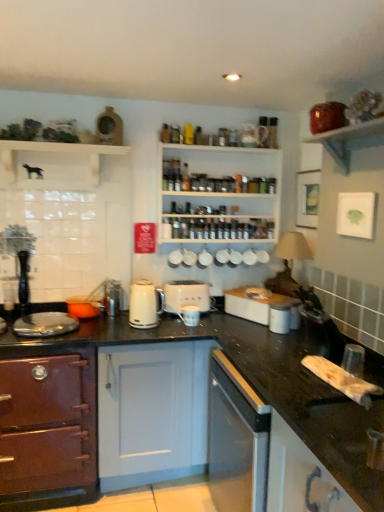
Locate an element on the screen. This screenshot has width=384, height=512. white ceramic mug at upper center is located at coordinates (204, 258).

Measure the distance between matte orange pot at left, the 1th appliance in the left-to-right sequence, and camera.

The distance of matte orange pot at left, the 1th appliance in the left-to-right sequence, from camera is 2.28 meters.

What do you see at coordinates (48, 423) in the screenshot? I see `matte purple oven at lower left, the 1th cabinetry viewed from the left` at bounding box center [48, 423].

Where is `white glossy kettle at center`? This screenshot has height=512, width=384. white glossy kettle at center is located at coordinates (145, 304).

I want to click on white matte dog at upper left, which is the first shelf from left to right, so click(x=55, y=163).

The width and height of the screenshot is (384, 512). Describe the element at coordinates (347, 140) in the screenshot. I see `matte brown bowl at upper right, positioned as the 1th shelf in right-to-left order` at that location.

What are the coordinates of `matte brown bowl at upper right, which appears as the 3th shelf when viewed from the left` in the screenshot? It's located at (347, 140).

What do you see at coordinates (190, 315) in the screenshot?
I see `porcelain matte mug at center, acting as the 2th appliance starting from the right` at bounding box center [190, 315].

Measure the distance between point (180,313) and camera.

Point (180,313) is 8.19 feet away from camera.

This screenshot has height=512, width=384. What are the coordinates of `white ceramic mug at upper center` in the screenshot? It's located at (204, 258).

Is white matte toaster at center, the 2th appliance in the left-to-right sequence, aimed at white glossy toaster at center, arranged as the 1th appliance when viewed from the right?

No, white matte toaster at center, the 2th appliance in the left-to-right sequence, is not turned towards white glossy toaster at center, arranged as the 1th appliance when viewed from the right.

Would you say white glossy toaster at center, the 4th appliance from the left, is part of white matte toaster at center, the 2th appliance in the left-to-right sequence,'s contents?

No.

From the image's perspective, count 1st appliances downward from the white matte toaster at center, the third appliance viewed from the right, and point to it. Please provide its 2D coordinates.

[(258, 305)]

Is point (178, 286) closer to viewer compared to point (243, 290)?

No, (178, 286) is behind (243, 290).

Does white ceramic mug at upper center turn towards white glossy toaster at center, arranged as the 1th appliance when viewed from the right?

No, white ceramic mug at upper center is not aimed at white glossy toaster at center, arranged as the 1th appliance when viewed from the right.

Is point (203, 255) closer or farther from the camera than point (253, 305)?

Point (203, 255).

From a real-world perspective, relative to white glossy toaster at center, arranged as the 1th appliance when viewed from the right, is white ceramic mug at upper center vertically above or below?

In terms of real-world spatial position, white ceramic mug at upper center is above white glossy toaster at center, arranged as the 1th appliance when viewed from the right.

From the picture: Who is taller, white ceramic mug at upper center or white glossy toaster at center, the 4th appliance from the left?

white glossy toaster at center, the 4th appliance from the left.

Can you tell me how much porcelain matte mug at center, marked as the third appliance in a left-to-right arrangement, and white glossy cabinet at lower right, which appears as the 2th cabinetry when viewed from the back, differ in facing direction?

The angle between the facing direction of porcelain matte mug at center, marked as the third appliance in a left-to-right arrangement, and the facing direction of white glossy cabinet at lower right, which appears as the 2th cabinetry when viewed from the back, is 92.6 degrees.

Between porcelain matte mug at center, acting as the 2th appliance starting from the right, and white glossy cabinet at lower right, which appears as the first cabinetry when viewed from the front, which one has smaller width?

porcelain matte mug at center, acting as the 2th appliance starting from the right.

Is point (190, 319) farther from camera compared to point (269, 507)?

Yes.

From a real-world perspective, is porcelain matte mug at center, acting as the 2th appliance starting from the right, positioned over white glossy cabinet at lower right, the 1th cabinetry in the right-to-left sequence, based on gravity?

Indeed, from a real-world perspective, porcelain matte mug at center, acting as the 2th appliance starting from the right, stands above white glossy cabinet at lower right, the 1th cabinetry in the right-to-left sequence.

What are the coordinates of `appliance that is the 3rd one when counting downward from the white matte toaster at center, the third appliance viewed from the right (from the image's perspective)` in the screenshot? It's located at (190, 315).

From the picture: Which object is positioned more to the left, white matte toaster at center, the 2th appliance in the left-to-right sequence, or porcelain matte mug at center, marked as the third appliance in a left-to-right arrangement?

white matte toaster at center, the 2th appliance in the left-to-right sequence, is more to the left.

Is white matte toaster at center, the 2th appliance in the left-to-right sequence, not close to porcelain matte mug at center, acting as the 2th appliance starting from the right?

They are positioned close to each other.

Which is behind, white matte toaster at center, the 2th appliance in the left-to-right sequence, or porcelain matte mug at center, acting as the 2th appliance starting from the right?

white matte toaster at center, the 2th appliance in the left-to-right sequence, is further away from the camera.

Between matte orange pot at left, which is the fourth appliance in right-to-left order, and white matte toaster at center, the third appliance viewed from the right, which one has smaller size?

matte orange pot at left, which is the fourth appliance in right-to-left order.

Is matte orange pot at left, the 1th appliance in the left-to-right sequence, far from white matte toaster at center, the 2th appliance in the left-to-right sequence?

Actually, matte orange pot at left, the 1th appliance in the left-to-right sequence, and white matte toaster at center, the 2th appliance in the left-to-right sequence, are a little close together.

Considering the positions of points (84, 306) and (193, 292), is point (84, 306) closer to camera compared to point (193, 292)?

That is True.

Relative to white ceramic mug at upper center, is matte brown bowl at upper right, the 1th shelf viewed from the front, in front or behind?

Clearly, matte brown bowl at upper right, the 1th shelf viewed from the front, is in front of white ceramic mug at upper center.

Is matte brown bowl at upper right, the 1th shelf viewed from the front, situated inside white ceramic mug at upper center or outside?

matte brown bowl at upper right, the 1th shelf viewed from the front, exists outside the volume of white ceramic mug at upper center.

Is white ceramic mug at upper center at the back of matte brown bowl at upper right, the 1th shelf viewed from the front?

No.

Who is bigger, matte brown bowl at upper right, which is the 3th shelf in back-to-front order, or white ceramic mug at upper center?

matte brown bowl at upper right, which is the 3th shelf in back-to-front order, is bigger.

Is white ceramic mug at upper center in contact with matte brown bowl at upper right, which appears as the 3th shelf when viewed from the left?

No, white ceramic mug at upper center is not in contact with matte brown bowl at upper right, which appears as the 3th shelf when viewed from the left.

Which object is positioned more to the left, white ceramic mug at upper center or matte brown bowl at upper right, the 1th shelf viewed from the front?

white ceramic mug at upper center.

From a real-world perspective, which object stands above the other?

matte brown bowl at upper right, which appears as the 3th shelf when viewed from the left.

Consider the image. Which object is thinner, white ceramic mug at upper center or matte brown bowl at upper right, which is the 3th shelf in back-to-front order?

white ceramic mug at upper center is thinner.

The width and height of the screenshot is (384, 512). Identify the location of appliance that is the 1st one when counting downward from the white matte toaster at center, the third appliance viewed from the right (from the image's perspective). pos(258,305).

Starting from the white ceramic mug at upper center, which appliance is the 2nd one in front? Please provide its 2D coordinates.

[(258, 305)]

From the image, which object appears to be farther from white glossy cabinet at lower right, the second cabinetry when ordered from left to right, matte orange pot at left, which is the fourth appliance in right-to-left order, or matte brown bowl at upper right, positioned as the 1th shelf in right-to-left order?

matte orange pot at left, which is the fourth appliance in right-to-left order, is positioned further to the anchor white glossy cabinet at lower right, the second cabinetry when ordered from left to right.

From the image, which object appears to be farther from black granite countertop at center, white glossy kettle at center or white wooden spice rack at upper center, the 2th shelf in the right-to-left sequence?

white wooden spice rack at upper center, the 2th shelf in the right-to-left sequence.

Estimate the real-world distances between objects in this image. Which object is closer to porcelain matte mug at center, marked as the third appliance in a left-to-right arrangement, white glossy toaster at center, arranged as the 1th appliance when viewed from the right, or matte purple oven at lower left, the first cabinetry when ordered from back to front?

Based on the image, white glossy toaster at center, arranged as the 1th appliance when viewed from the right, appears to be nearer to porcelain matte mug at center, marked as the third appliance in a left-to-right arrangement.

From the image, which object appears to be farther from white ceramic mug at upper center, white wooden spice rack at upper center, which is the second shelf from left to right, or matte brown bowl at upper right, which is the 3th shelf in back-to-front order?

matte brown bowl at upper right, which is the 3th shelf in back-to-front order, is positioned further to the anchor white ceramic mug at upper center.

Looking at the image, which one is located further to white glossy cabinet at lower right, which appears as the first cabinetry when viewed from the front, white matte toaster at center, the third appliance viewed from the right, or white ceramic mug at upper center?

white ceramic mug at upper center lies further to white glossy cabinet at lower right, which appears as the first cabinetry when viewed from the front, than the other object.

When comparing their distances from porcelain matte mug at center, acting as the 2th appliance starting from the right, does matte brown bowl at upper right, the 1th shelf viewed from the front, or white ceramic mug at upper center seem further?

matte brown bowl at upper right, the 1th shelf viewed from the front, lies further to porcelain matte mug at center, acting as the 2th appliance starting from the right, than the other object.

Looking at the image, which one is located closer to white wooden spice rack at upper center, the first shelf viewed from the back, matte orange pot at left, the 1th appliance in the left-to-right sequence, or matte brown bowl at upper right, positioned as the 1th shelf in right-to-left order?

matte brown bowl at upper right, positioned as the 1th shelf in right-to-left order, is closer to white wooden spice rack at upper center, the first shelf viewed from the back.

When comparing their distances from black granite countertop at center, does matte orange pot at left, which is the fourth appliance in right-to-left order, or white wooden spice rack at upper center, the first shelf viewed from the back, seem closer?

The object closer to black granite countertop at center is matte orange pot at left, which is the fourth appliance in right-to-left order.

What are the coordinates of `kitchen appliance situated between white matte dog at upper left, placed as the third shelf when sorted from right to left, and matte brown bowl at upper right, positioned as the 1th shelf in right-to-left order, from left to right` in the screenshot? It's located at (145, 304).

I want to click on kitchen appliance between white matte dog at upper left, arranged as the second shelf when viewed from the front, and white wooden spice rack at upper center, the third shelf when ordered from front to back, in the horizontal direction, so click(x=145, y=304).

Where is `tableware that lies between matte brown bowl at upper right, which is the 3th shelf in back-to-front order, and black granite countertop at center from top to bottom`? The image size is (384, 512). tableware that lies between matte brown bowl at upper right, which is the 3th shelf in back-to-front order, and black granite countertop at center from top to bottom is located at coordinates (204, 258).

Find the location of a particular element. countertop between matte purple oven at lower left, the first cabinetry when ordered from back to front, and matte brown bowl at upper right, the 1th shelf viewed from the front is located at coordinates (258, 387).